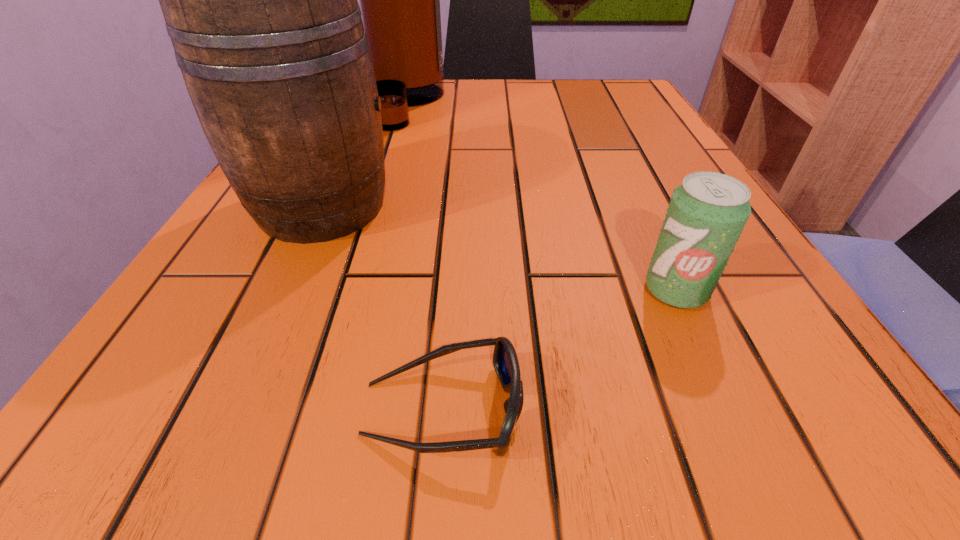
At what (x,y) coordinates should I click in order to perform the action: click on the tallest object. Please return your answer as a coordinate pair (x, y). The height and width of the screenshot is (540, 960). Looking at the image, I should click on (399, 0).

At what (x,y) coordinates should I click in order to perform the action: click on the farthest object. Please return your answer as a coordinate pair (x, y). Looking at the image, I should click on (399, 0).

Locate an element on the screen. The width and height of the screenshot is (960, 540). the second tallest object is located at coordinates (260, 1).

The width and height of the screenshot is (960, 540). What are the coordinates of `cider` in the screenshot? It's located at (260, 1).

The width and height of the screenshot is (960, 540). Find the location of `the rightmost object`. the rightmost object is located at coordinates (707, 213).

Find the location of a particular element. Image resolution: width=960 pixels, height=540 pixels. the second shortest object is located at coordinates (707, 213).

Identify the location of sunglasses. The width and height of the screenshot is (960, 540). (505, 361).

The image size is (960, 540). What are the coordinates of `the shortest object` in the screenshot? It's located at (505, 361).

Find the location of a particular element. vacant area located on the front label of the liquor is located at coordinates (515, 104).

I want to click on vacant space located 0.110m on the side of the cider near the bung hole, so click(465, 206).